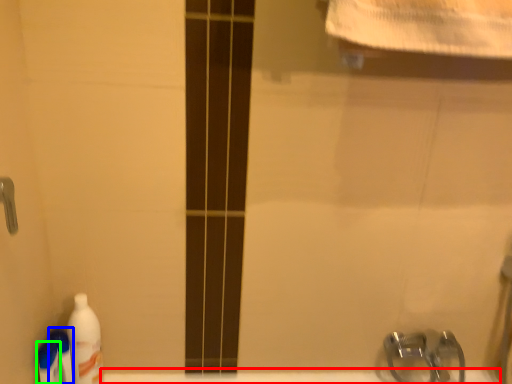
Question: Estimate the real-world distances between objects in this image. Which object is farther from bath (highlighted by a red box), cleaning product (highlighted by a blue box) or cleaning product (highlighted by a green box)?

Choices:
 (A) cleaning product
 (B) cleaning product

Answer: (B)